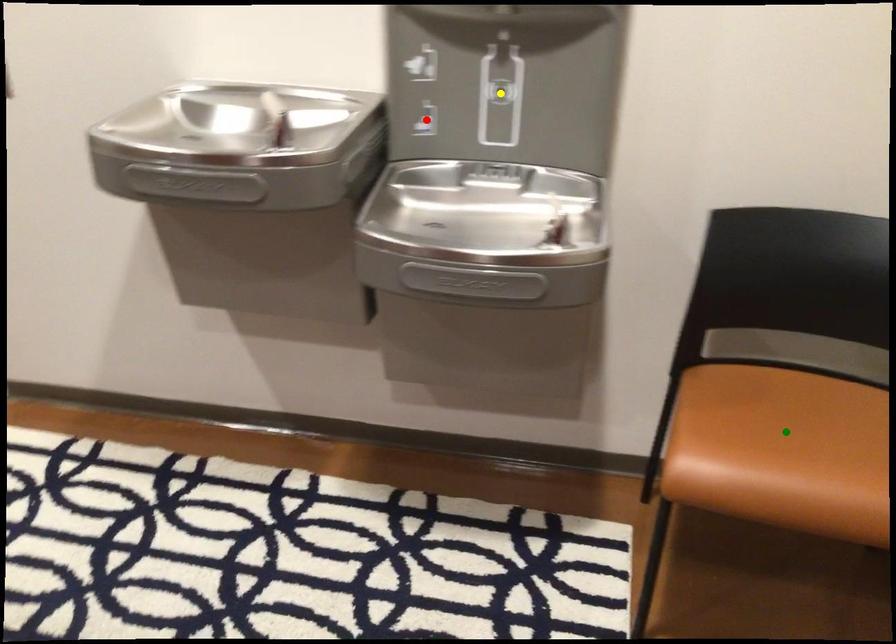
Order these from farthest to nearest:
1. red point
2. green point
3. yellow point

red point → yellow point → green point